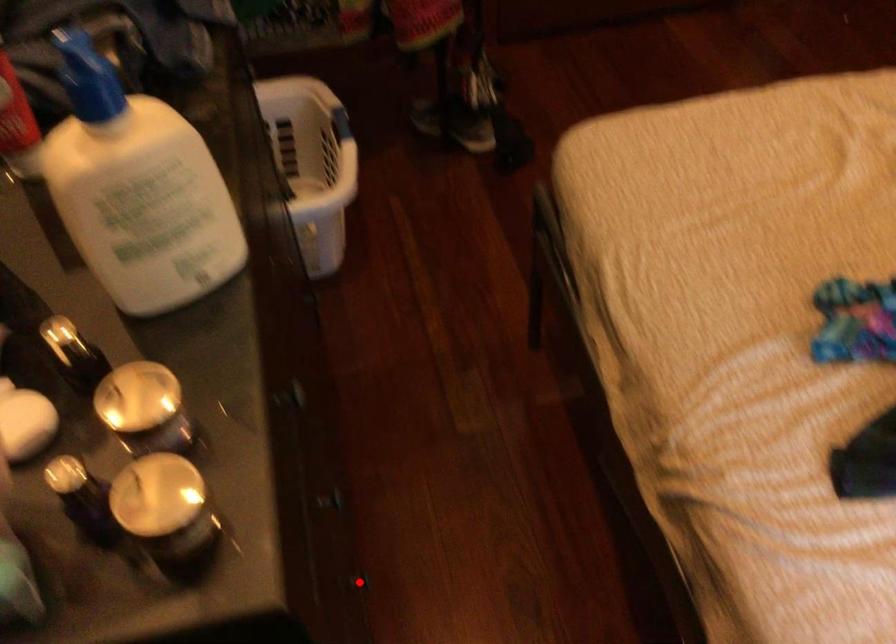
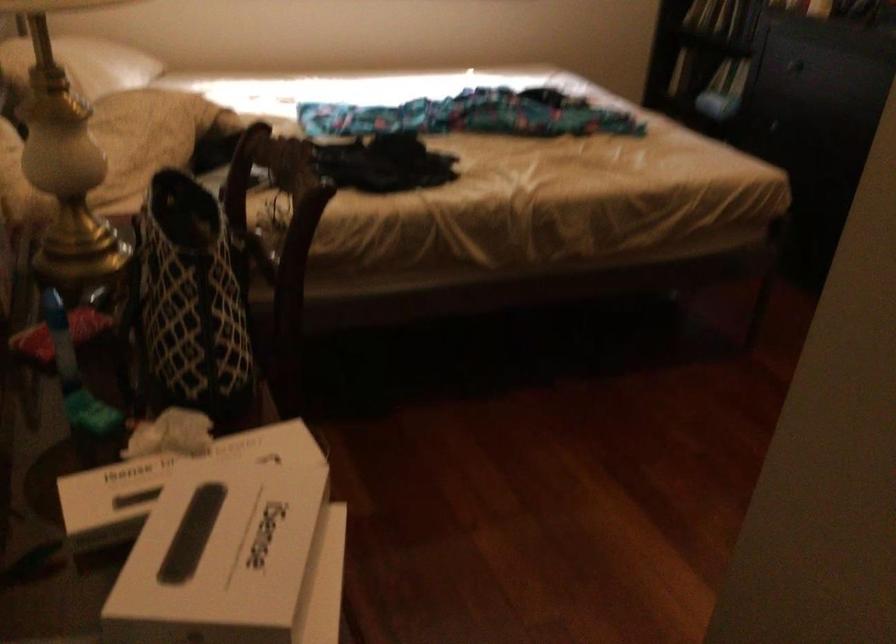
Question: I am providing you with two images of the same scene from different viewpoints. A red point is marked on the first image. At the location where the point appears in image 1, is it still visible in image 2?

Choices:
 (A) Yes
 (B) No

Answer: (B)